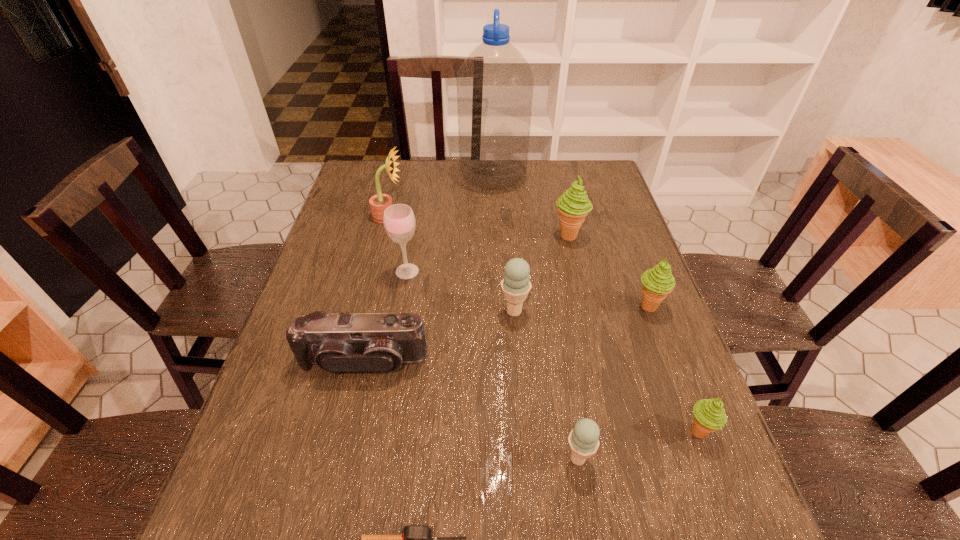
Identify which icecream is located as the nearest to the right blue ice cream. Please provide its 2D coordinates. Your answer should be formatted as a tuple, i.e. [(x, y)], where the tuple contains the x and y coordinates of a point satisfying the conditions above.

[(709, 414)]

Find the location of a particular element. The height and width of the screenshot is (540, 960). the second closest green icecream to the leftmost green icecream is located at coordinates (709, 414).

Locate which green icecream is the closest to the sunflower. Please provide its 2D coordinates. Your answer should be formatted as a tuple, i.e. [(x, y)], where the tuple contains the x and y coordinates of a point satisfying the conditions above.

[(573, 206)]

Image resolution: width=960 pixels, height=540 pixels. Identify the location of blank space that satisfies the following two spatial constraints: 1. on the face of the sunflower; 2. on the back side of the second farthest green icecream. (366, 306).

Locate an element on the screen. The image size is (960, 540). free space that satisfies the following two spatial constraints: 1. on the face of the sunflower; 2. on the left side of the bigger blue ice cream is located at coordinates (365, 311).

The width and height of the screenshot is (960, 540). In order to click on free space that satisfies the following two spatial constraints: 1. on the face of the third icecream from right to left; 2. on the left side of the sunflower in this screenshot , I will do `click(384, 236)`.

The image size is (960, 540). In order to click on free space that satisfies the following two spatial constraints: 1. on the face of the sunflower; 2. on the left side of the leftmost green icecream in this screenshot , I will do `click(384, 236)`.

At what (x,y) coordinates should I click in order to perform the action: click on vacant point that satisfies the following two spatial constraints: 1. on the back side of the third object from right to left; 2. on the right side of the wineglass. Please return your answer as a coordinate pair (x, y). The height and width of the screenshot is (540, 960). Looking at the image, I should click on (413, 236).

Find the location of a particular element. The width and height of the screenshot is (960, 540). vacant space that satisfies the following two spatial constraints: 1. on the front side of the second nearest green icecream; 2. on the right side of the fourth farthest object is located at coordinates (401, 306).

I want to click on blank space that satisfies the following two spatial constraints: 1. on the back side of the farther blue ice cream; 2. on the face of the yellow sunflower, so click(507, 217).